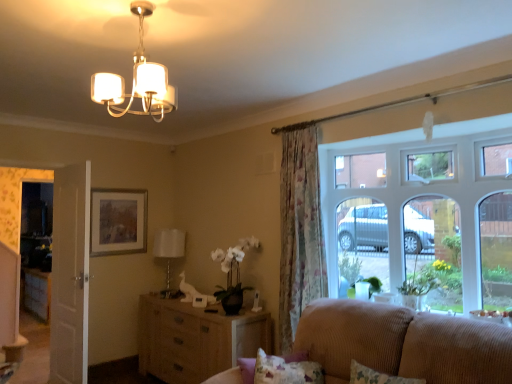
Question: Does point (35, 286) appear closer or farther from the camera than point (190, 365)?

Choices:
 (A) closer
 (B) farther

Answer: (B)

Question: In terms of size, does transparent glass door at left appear bigger or smaller than woven wood dresser at center?

Choices:
 (A) big
 (B) small

Answer: (B)

Question: Considering the real-world distances, which object is closest to the wooden picture frame at upper left?

Choices:
 (A) transparent glass door at left
 (B) white glass lamp at center, which is counted as the 1th lamp, starting from the back
 (C) matte white chandelier at upper center, the first lamp viewed from the top
 (D) floral fabric curtain at center
 (E) fluffy fabric pillow at lower right

Answer: (B)

Question: Which of these objects is positioned farthest from the wooden picture frame at upper left?

Choices:
 (A) beige corduroy couch at lower right
 (B) woven wood dresser at center
 (C) clear glass window at center
 (D) floral fabric curtain at center
 (E) matte white chandelier at upper center, the 2th lamp in the left-to-right sequence

Answer: (A)